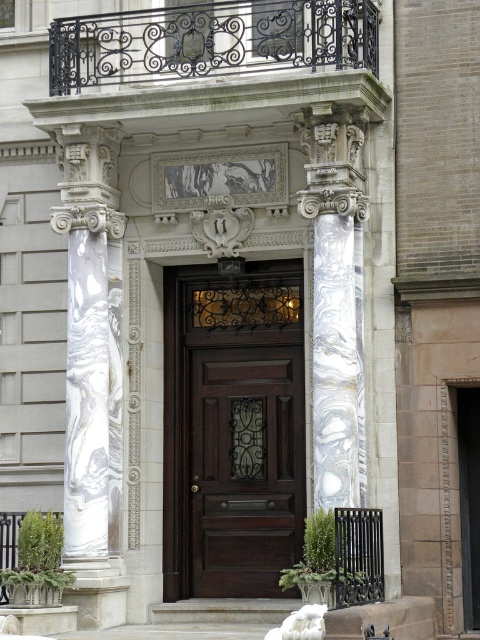
Question: Does dark wood door at center appear under white marble stairs at center?

Choices:
 (A) yes
 (B) no

Answer: (B)

Question: Can you confirm if dark wood door at center is positioned to the left of white marble stairs at center?

Choices:
 (A) yes
 (B) no

Answer: (B)

Question: Is dark wood door at center wider than white marble stairs at center?

Choices:
 (A) no
 (B) yes

Answer: (A)

Question: Which object is farther from the camera taking this photo?

Choices:
 (A) white marble stairs at center
 (B) dark wood door at center

Answer: (B)